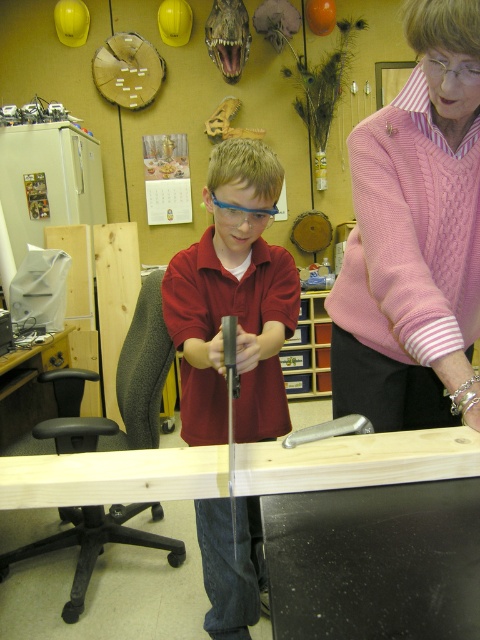
Question: Which point is farther to the camera?

Choices:
 (A) (439, 211)
 (B) (46, 369)

Answer: (B)

Question: Which of the following is the closest to the observer?

Choices:
 (A) (253, 380)
 (B) (347, 356)
 (C) (12, 368)

Answer: (B)

Question: Is pink knitted sweater at upper right positioned at the back of matte plastic glasses at center?

Choices:
 (A) no
 (B) yes

Answer: (A)

Question: Which of these objects is positioned closest to the pink knitted sweater at upper right?

Choices:
 (A) black plastic workbench at lower center
 (B) matte plastic glasses at center

Answer: (B)

Question: Is matte plastic glasses at center below black plastic workbench at lower center?

Choices:
 (A) yes
 (B) no

Answer: (B)

Question: Is pink knitted sweater at upper right above black plastic workbench at lower center?

Choices:
 (A) yes
 (B) no

Answer: (A)